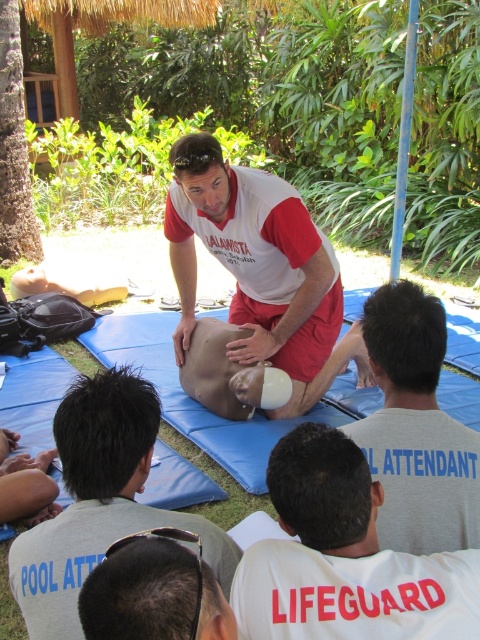
You are a participant in the CPR training session and need to locate the instructor. Where exactly is the gray matte lifeguard shirt at center located in the image?

The gray matte lifeguard shirt at center is located at point 0.670 on the x axis and 0.867 on the y axis.

You are a participant in the CPR training session. You notice a specific point marked at coordinates [344,557]. Based on the scene description, can you identify which object or part of clothing this point corresponds to?

The point at coordinates [344,557] is located on the white cotton shirt at center.